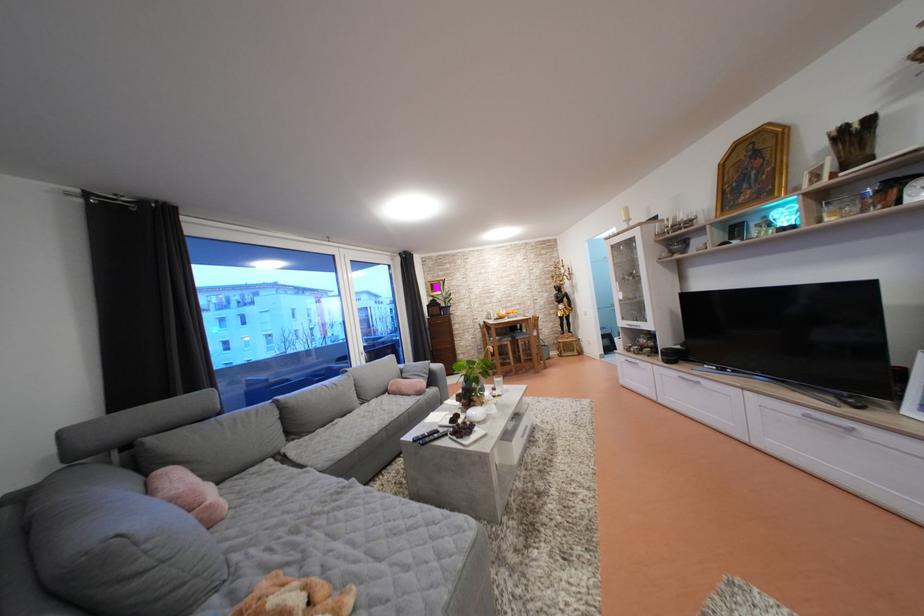
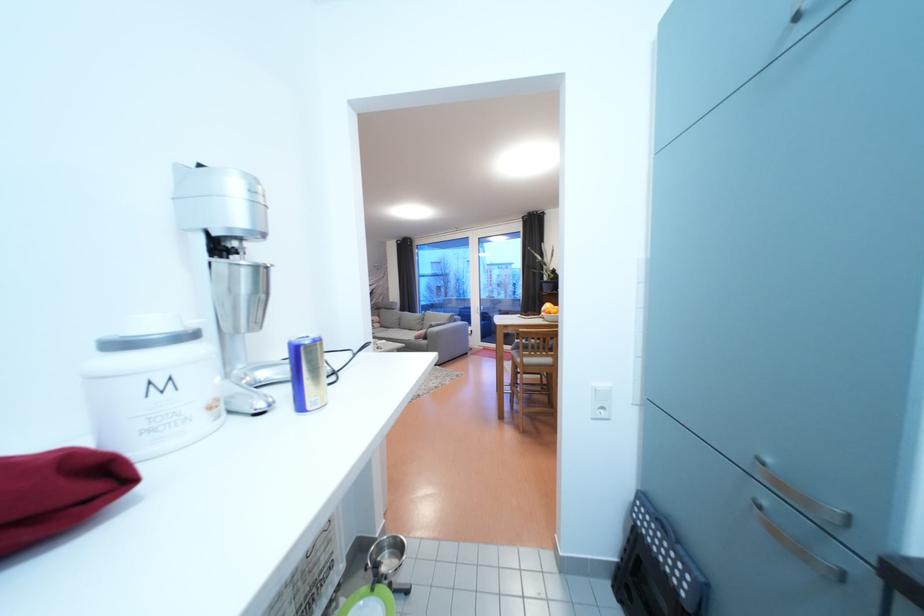
Question: I am providing you with two images of the same scene from different viewpoints. Please identify which objects are invisible in image2.

Choices:
 (A) brown stuffed animal
 (B) red wine bottle
 (C) white container lid
 (D) black step stool

Answer: (A)